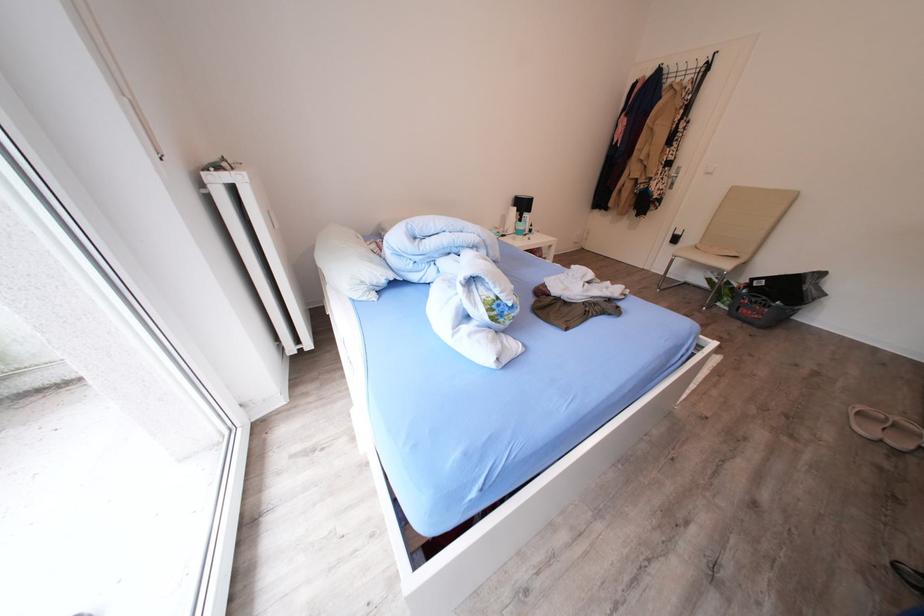
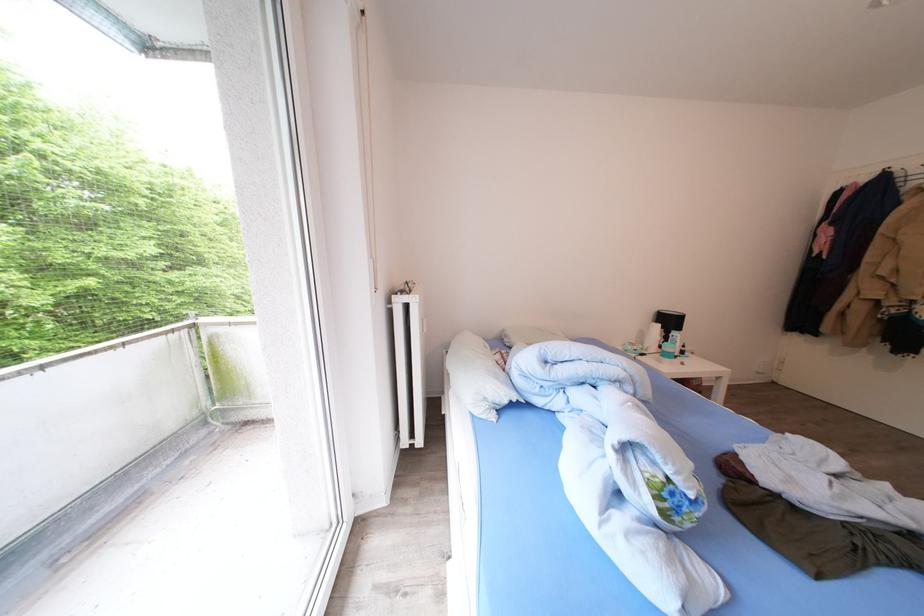
Find the pixel in the second image that matches pixel 513 224 in the first image.

(650, 339)